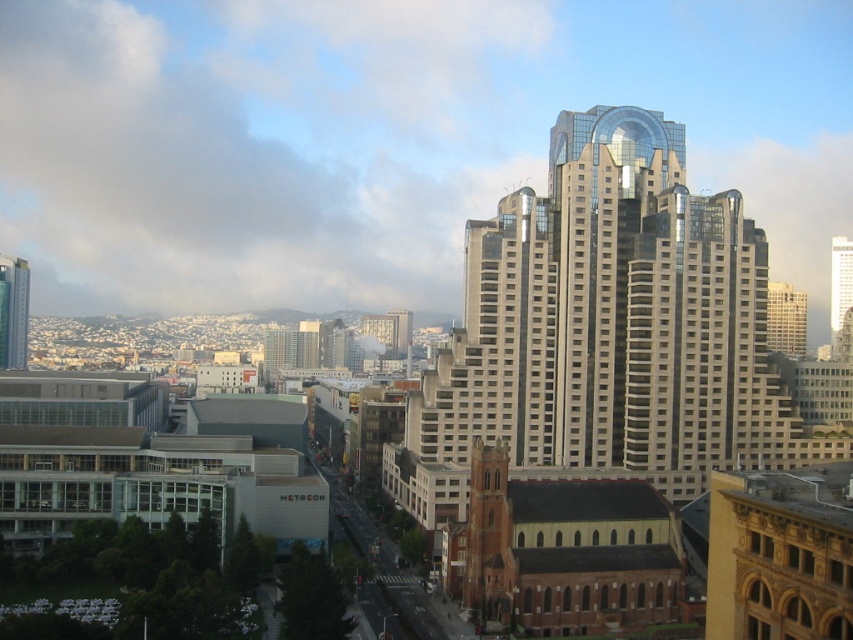
Can you confirm if glassy metallic skyscraper at center is taller than glassy skyscraper at center?

Indeed, glassy metallic skyscraper at center has a greater height compared to glassy skyscraper at center.

Can you confirm if glassy metallic skyscraper at center is shorter than glassy skyscraper at center?

In fact, glassy metallic skyscraper at center may be taller than glassy skyscraper at center.

Where is `glassy metallic skyscraper at center`? glassy metallic skyscraper at center is located at coordinates (605, 332).

Identify the location of glassy metallic skyscraper at center. (605, 332).

Can you confirm if glassy metallic skyscraper at center is wider than matte silver skyscraper at left?

Correct, the width of glassy metallic skyscraper at center exceeds that of matte silver skyscraper at left.

Measure the distance between glassy metallic skyscraper at center and camera.

glassy metallic skyscraper at center is 119.71 meters from camera.

Locate an element on the screen. This screenshot has width=853, height=640. glassy metallic skyscraper at center is located at coordinates (605, 332).

This screenshot has height=640, width=853. Identify the location of glassy metallic skyscraper at center. point(605,332).

Which is behind, point (19, 352) or point (840, 314)?

The point (840, 314) is behind.

Between matte silver skyscraper at left and glassy skyscraper at center, which one appears on the left side from the viewer's perspective?

From the viewer's perspective, matte silver skyscraper at left appears more on the left side.

Is point (16, 284) in front of point (849, 268)?

Yes, it is in front of point (849, 268).

The width and height of the screenshot is (853, 640). Identify the location of matte silver skyscraper at left. (13, 310).